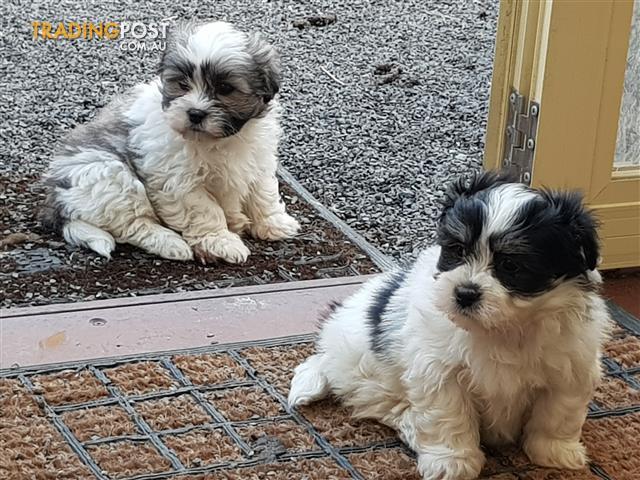
At what (x,y) coordinates should I click in order to perform the action: click on door. Please return your answer as a coordinate pair (x, y). The image size is (640, 480). Looking at the image, I should click on (582, 96).